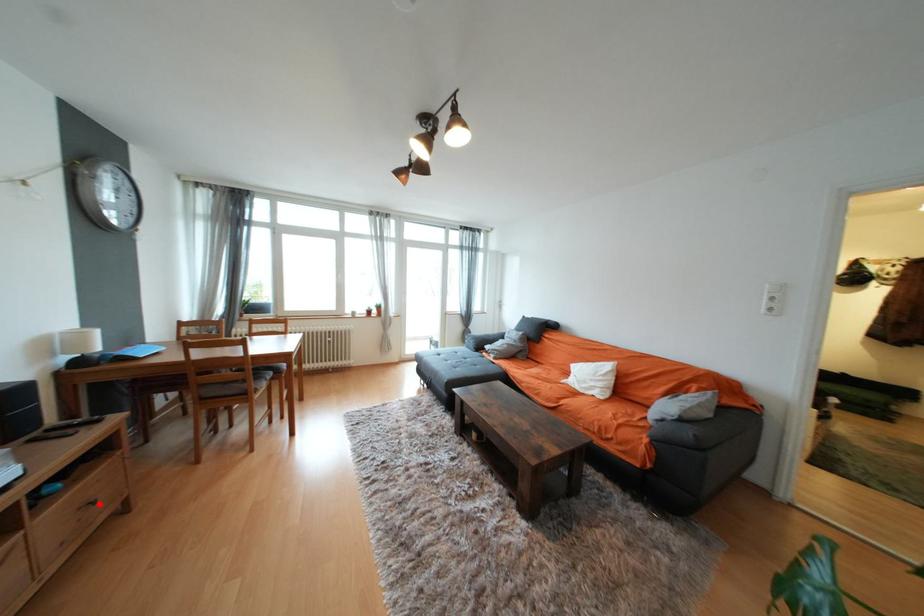
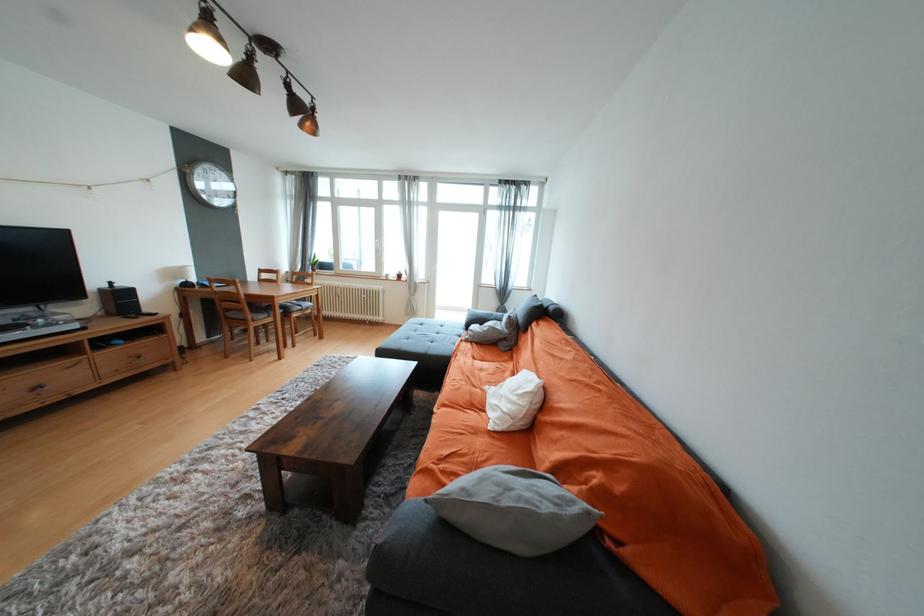
In the second image, find the point that corresponds to the highlighted location in the first image.

(146, 358)